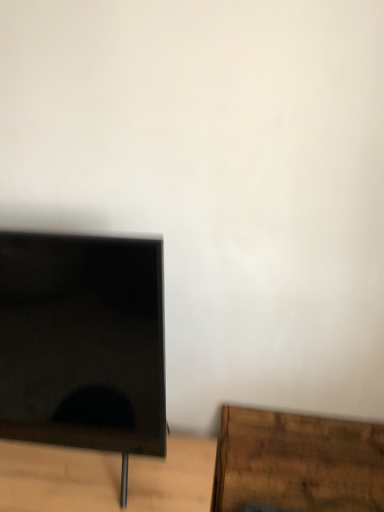
Question: From a real-world perspective, is brown wooden table at lower left above or below brown wood table at lower right?

Choices:
 (A) below
 (B) above

Answer: (A)

Question: From the image's perspective, is brown wooden table at lower left above or below brown wood table at lower right?

Choices:
 (A) above
 (B) below

Answer: (B)

Question: Considering the real-world distances, which object is farthest from the black glossy monitor at left?

Choices:
 (A) brown wooden table at lower left
 (B) brown wood table at lower right

Answer: (B)

Question: Considering the real-world distances, which object is farthest from the brown wood table at lower right?

Choices:
 (A) brown wooden table at lower left
 (B) black glossy monitor at left

Answer: (B)